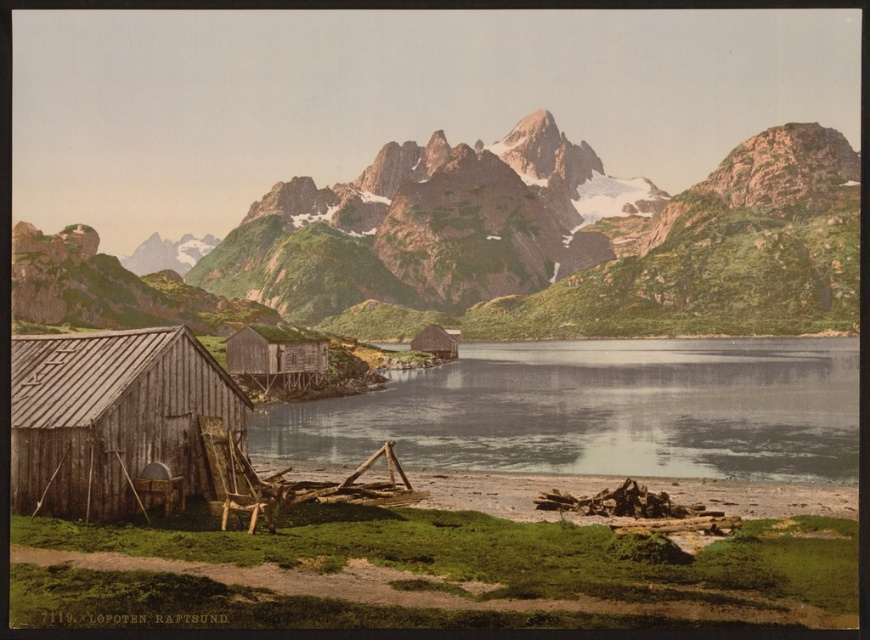
Question: Which object is closer to the camera taking this photo?

Choices:
 (A) smooth gray water at center
 (B) brown wood logs at lower center
 (C) wooden shack at lower left
 (D) rugged stone mountains at upper center

Answer: (C)

Question: Estimate the real-world distances between objects in this image. Which object is closer to the rugged stone mountains at upper center?

Choices:
 (A) wooden shack at lower left
 (B) smooth gray water at center
 (C) brown wood logs at lower center
 (D) wooden cabin at center

Answer: (B)

Question: Can you confirm if smooth gray water at center is positioned above wooden cabin at center?

Choices:
 (A) yes
 (B) no

Answer: (B)

Question: Does wooden shack at lower left have a smaller size compared to brown wood logs at lower center?

Choices:
 (A) yes
 (B) no

Answer: (B)

Question: Which is nearer to the wooden shack at lower left?

Choices:
 (A) rugged stone mountains at upper center
 (B) brown wood logs at lower center
 (C) wooden cabin at center
 (D) smooth gray water at center

Answer: (B)

Question: Does smooth gray water at center have a larger size compared to wooden shack at lower left?

Choices:
 (A) yes
 (B) no

Answer: (A)